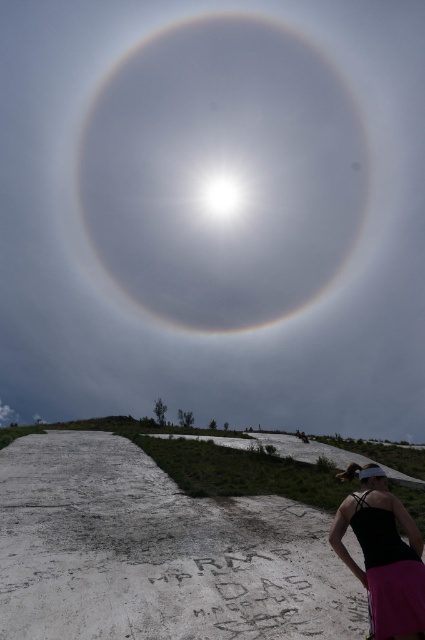
Question: Does white translucent halo at upper center have a lesser width compared to black fabric tank top at lower right?

Choices:
 (A) yes
 (B) no

Answer: (B)

Question: Which object is farther from the camera taking this photo?

Choices:
 (A) white translucent halo at upper center
 (B) black fabric tank top at lower right

Answer: (A)

Question: Can you confirm if white translucent halo at upper center is positioned to the left of black fabric tank top at lower right?

Choices:
 (A) yes
 (B) no

Answer: (A)

Question: Which of the following is the closest to the observer?

Choices:
 (A) black fabric tank top at lower right
 (B) white translucent halo at upper center

Answer: (A)

Question: In this image, where is white translucent halo at upper center located relative to black fabric tank top at lower right?

Choices:
 (A) left
 (B) right

Answer: (A)

Question: Among these points, which one is farthest from the camera?

Choices:
 (A) (337, 548)
 (B) (210, 234)

Answer: (B)